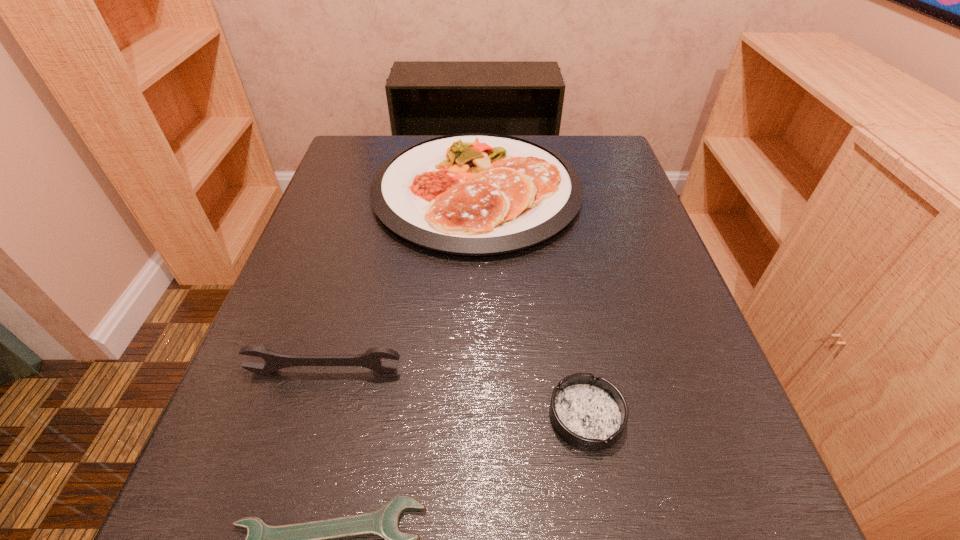
The height and width of the screenshot is (540, 960). Identify the location of vacant space that satisfies the following two spatial constraints: 1. on the front side of the second nearest object; 2. on the right side of the farthest object. (474, 416).